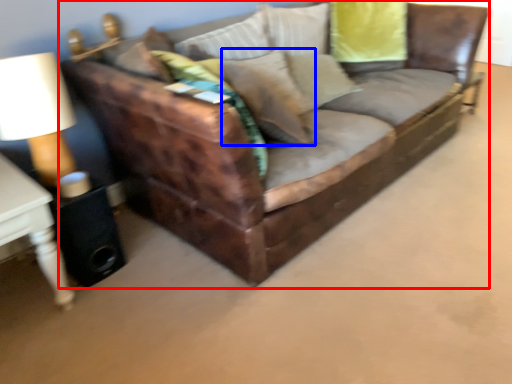
Question: Among these objects, which one is farthest to the camera, studio couch (highlighted by a red box) or pillow (highlighted by a blue box)?

Choices:
 (A) studio couch
 (B) pillow

Answer: (B)